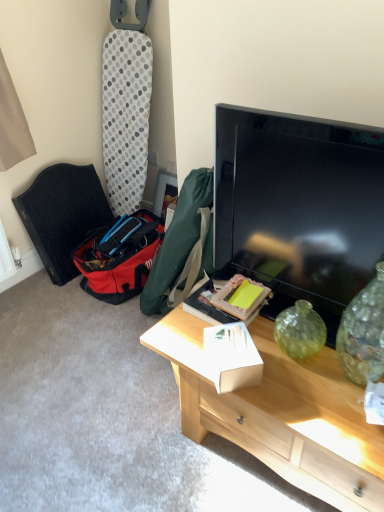
Locate an element on the screen. free space to the left of light wood desk at center is located at coordinates (116, 421).